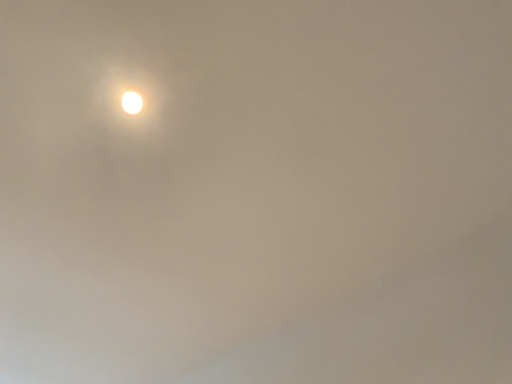
At what (x,y) coordinates should I click in order to perform the action: click on bright white orb at upper left. Please return your answer as a coordinate pair (x, y). This screenshot has height=384, width=512. Looking at the image, I should click on (132, 101).

This screenshot has height=384, width=512. What do you see at coordinates (132, 101) in the screenshot?
I see `bright white orb at upper left` at bounding box center [132, 101].

The image size is (512, 384). Identify the location of bright white orb at upper left. (132, 101).